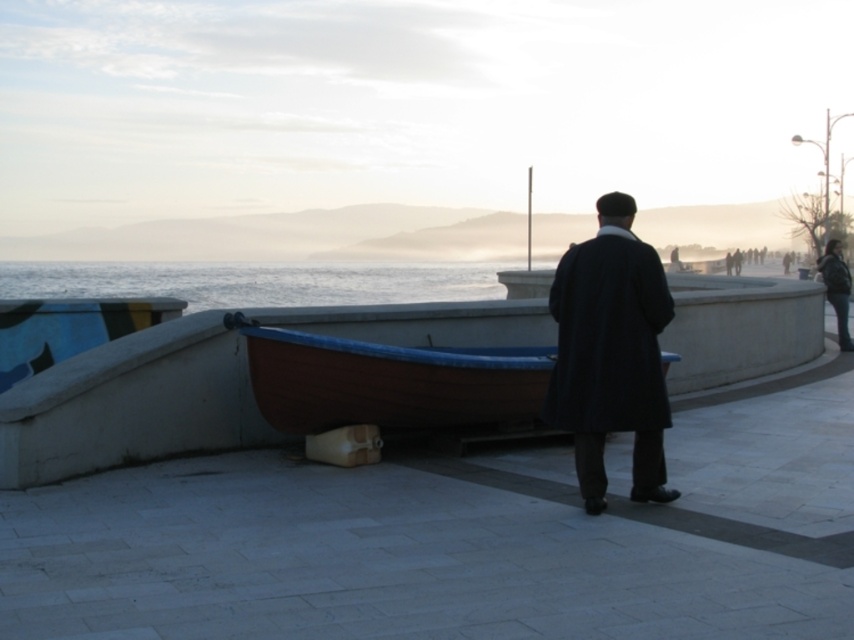
Between point (654, 481) and point (825, 257), which one is positioned in front?

Point (654, 481) is in front.

Between point (560, 316) and point (841, 282), which one is positioned in front?

Point (560, 316)

Identify the location of dark wool coat at center. The width and height of the screenshot is (854, 640). [611, 353].

Is dark wool coat at center positioned behind wooden canoe at center?

No, it is in front of wooden canoe at center.

Which is behind, point (589, 417) or point (459, 426)?

Positioned behind is point (459, 426).

You are a GUI agent. You are given a task and a screenshot of the screen. Output one action in this format:
    pyautogui.click(x=<x>, y=<y>)
    Task: Click on the dark wool coat at center
    The image size is (854, 640).
    Given the screenshot: What is the action you would take?
    pyautogui.click(x=611, y=353)

Is dark wool coat at center positioned behind blue water at center?

No.

Describe the element at coordinates (611, 353) in the screenshot. I see `dark wool coat at center` at that location.

Which is in front, point (571, 410) or point (226, 273)?

Point (571, 410) is more forward.

Locate an element on the screen. dark wool coat at center is located at coordinates (611, 353).